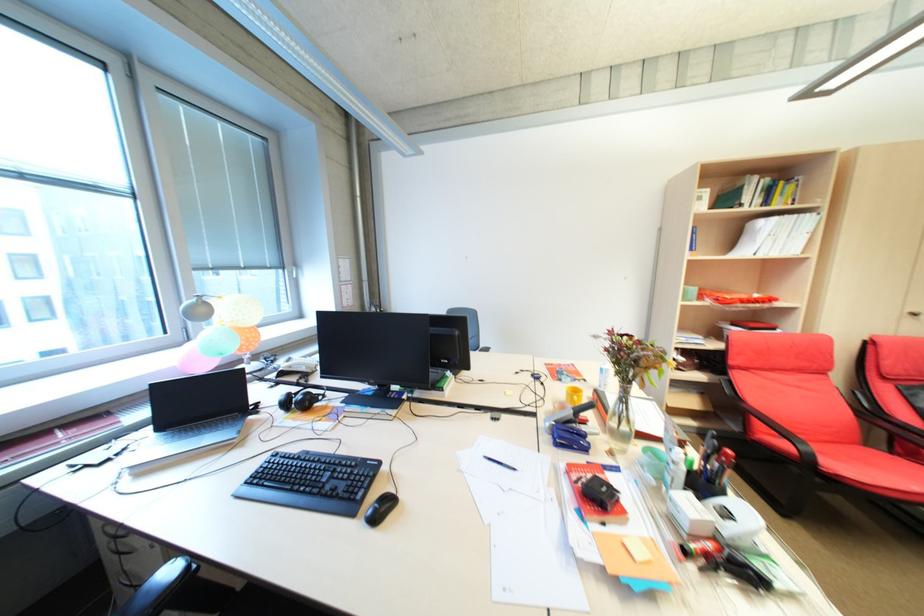
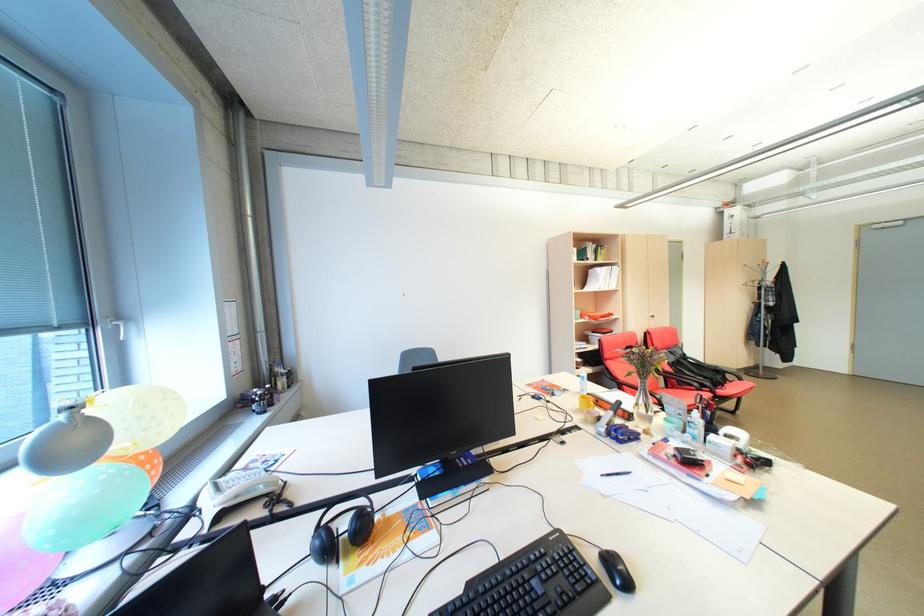
Where in the second image is the point corresponding to pixel 623 416 from the first image?

(646, 406)